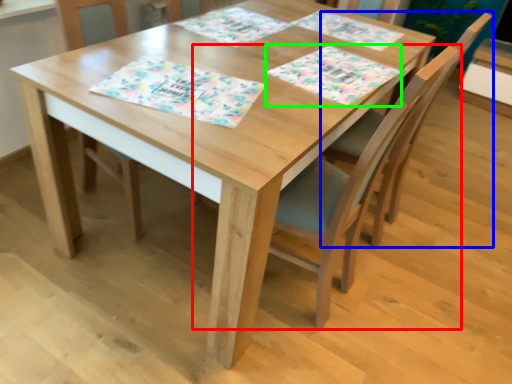
Question: Estimate the real-world distances between objects in this image. Which object is farther from chair (highlighted by a red box), chair (highlighted by a blue box) or place mat (highlighted by a green box)?

Choices:
 (A) chair
 (B) place mat

Answer: (B)